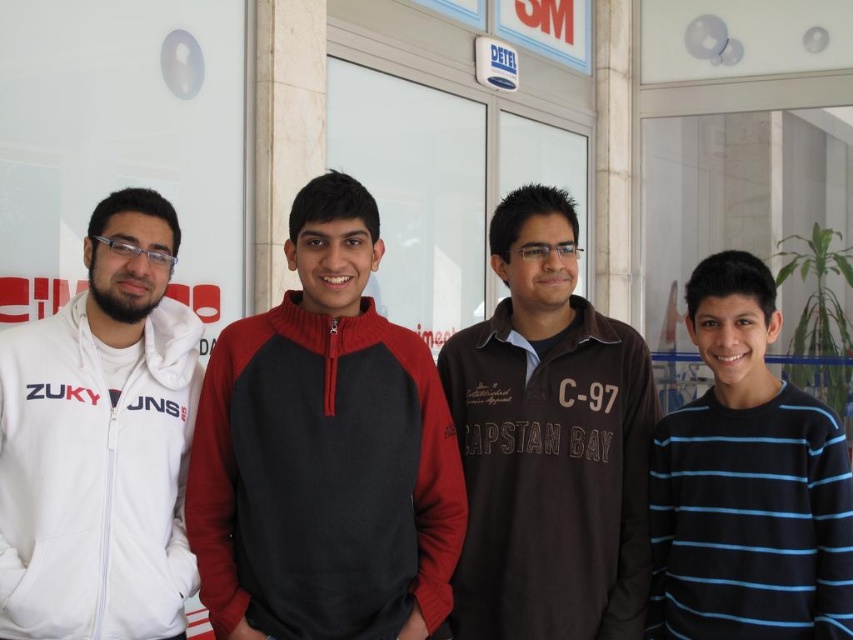
Does point (67, 344) come in front of point (503, 384)?

Yes, point (67, 344) is in front of point (503, 384).

Who is shorter, white fleece jacket at left or brown cotton shirt at center?

white fleece jacket at left is shorter.

Is point (113, 525) closer to camera compared to point (486, 432)?

That is True.

Locate an element on the screen. The height and width of the screenshot is (640, 853). white fleece jacket at left is located at coordinates (100, 442).

Who is positioned more to the left, dark gray fleece sweatshirt at center or brown cotton shirt at center?

dark gray fleece sweatshirt at center is more to the left.

Which is in front, point (412, 528) or point (634, 484)?

Point (412, 528) is in front.

Image resolution: width=853 pixels, height=640 pixels. I want to click on dark gray fleece sweatshirt at center, so click(323, 477).

Does white fleece jacket at left have a larger size compared to blue striped sweater at right?

Correct, white fleece jacket at left is larger in size than blue striped sweater at right.

Is white fleece jacket at left in front of blue striped sweater at right?

Yes, white fleece jacket at left is closer to the viewer.

Between point (51, 548) and point (664, 444), which one is positioned behind?

Point (664, 444)

You are a GUI agent. You are given a task and a screenshot of the screen. Output one action in this format:
    pyautogui.click(x=<x>, y=<y>)
    Task: Click on the white fleece jacket at left
    This screenshot has width=853, height=640.
    Given the screenshot: What is the action you would take?
    pyautogui.click(x=100, y=442)